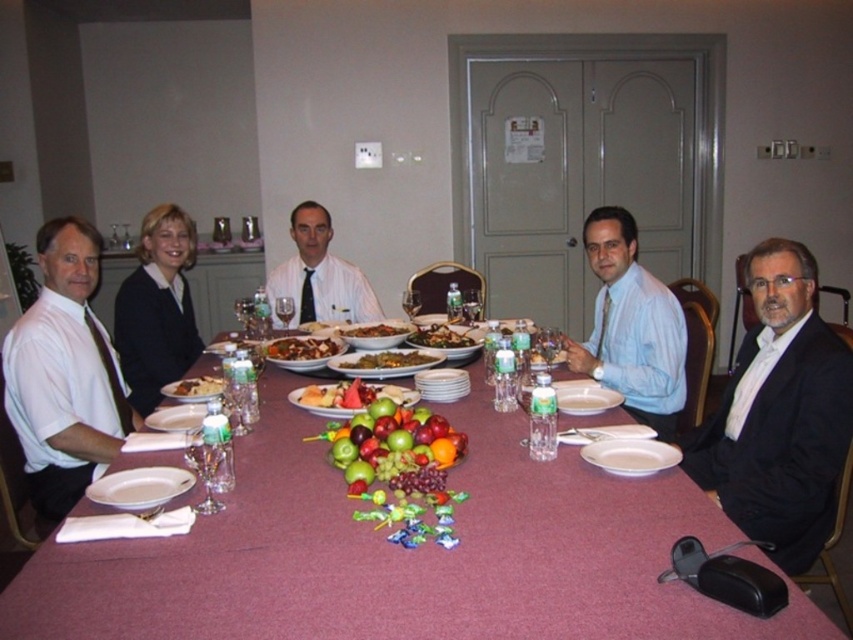
You are a server at a restaurant and need to place a new dish on the table. The dish is 3 inches tall. There is a white ceramic plate at lower center and a brown glossy meat at center. Which object should you place the dish next to so that it doesn

The white ceramic plate at lower center has a lesser height compared to brown glossy meat at center. Therefore, placing the dish next to the white ceramic plate at lower center would provide more space vertically since the plate is shorter than the meat.

You are standing at the dining table and want to reach the point marked as point (392, 452) from point (167, 394). Which direction should you move in?

You should move forward because point (392, 452) is in front of point (167, 394).